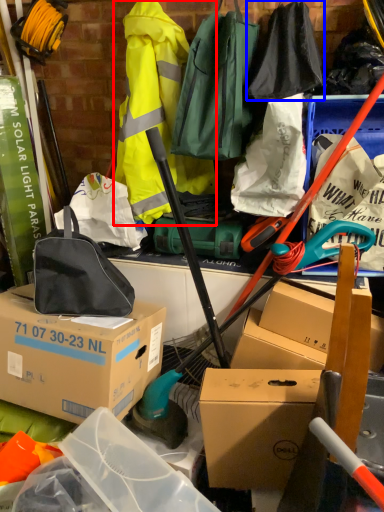
Question: Which point is closer to the camera, clothing (highlighted by a red box) or clothing (highlighted by a blue box)?

Choices:
 (A) clothing
 (B) clothing

Answer: (B)